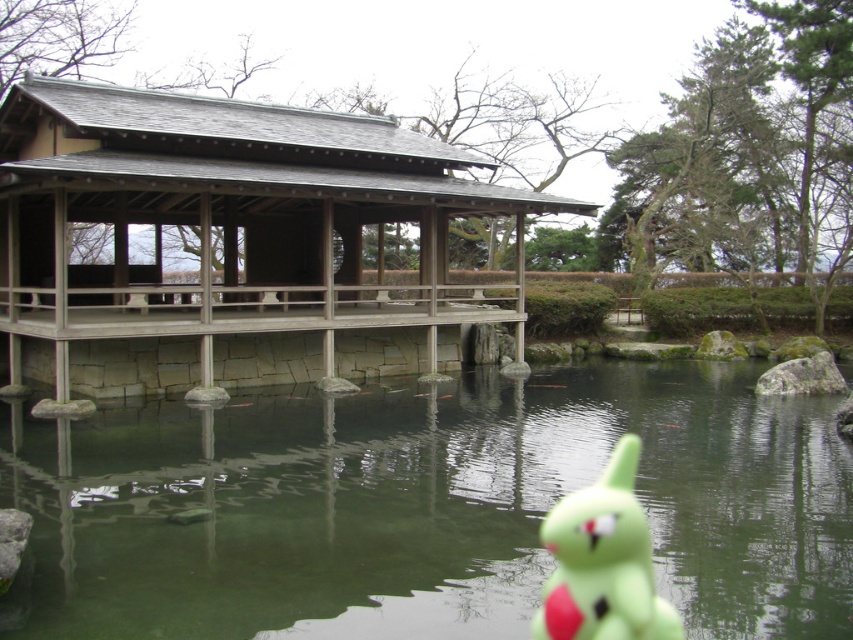
Looking at this image, does green translucent water at center come in front of wooden/stone pavilion at center?

Yes.

Does green translucent water at center appear on the right side of wooden/stone pavilion at center?

Correct, you'll find green translucent water at center to the right of wooden/stone pavilion at center.

I want to click on green translucent water at center, so click(425, 508).

Can you confirm if green translucent water at center is positioned to the right of green rubber toy at lower right?

Correct, you'll find green translucent water at center to the right of green rubber toy at lower right.

Is green translucent water at center wider than green rubber toy at lower right?

Correct, the width of green translucent water at center exceeds that of green rubber toy at lower right.

Is point (454, 552) positioned before point (646, 604)?

That is False.

The width and height of the screenshot is (853, 640). I want to click on green translucent water at center, so click(x=425, y=508).

Is point (494, 324) in front of point (573, 598)?

No.

Locate an element on the screen. The width and height of the screenshot is (853, 640). wooden/stone pavilion at center is located at coordinates (234, 243).